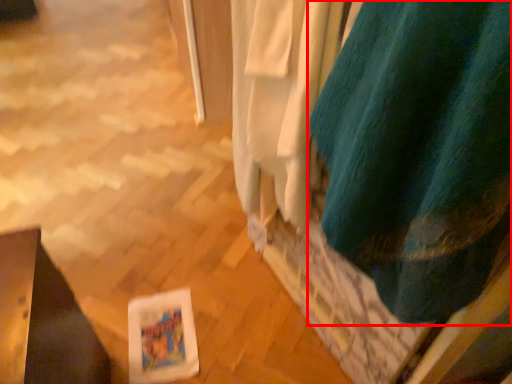
Question: From the image's perspective, where is curtain (annotated by the red box) located in relation to curtain in the image?

Choices:
 (A) below
 (B) above

Answer: (A)